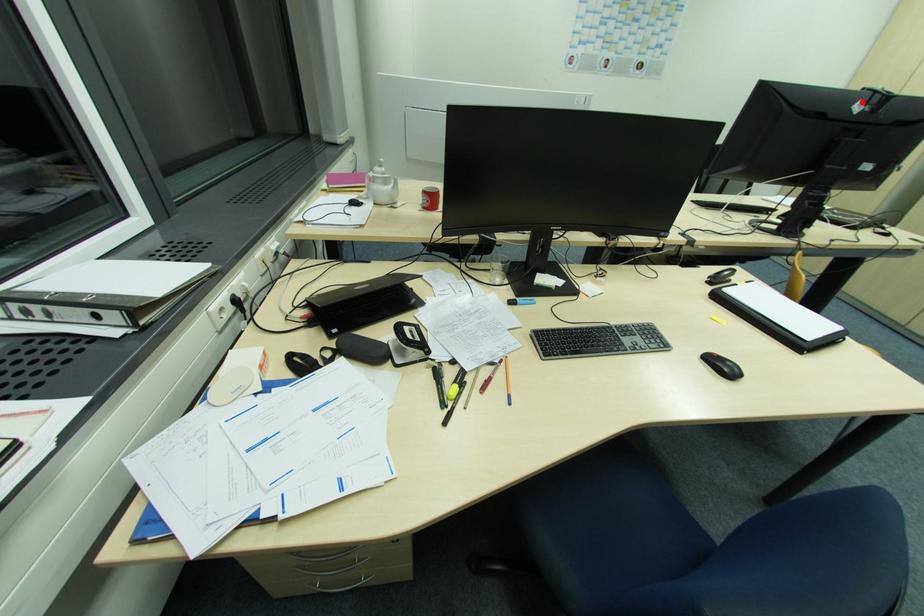
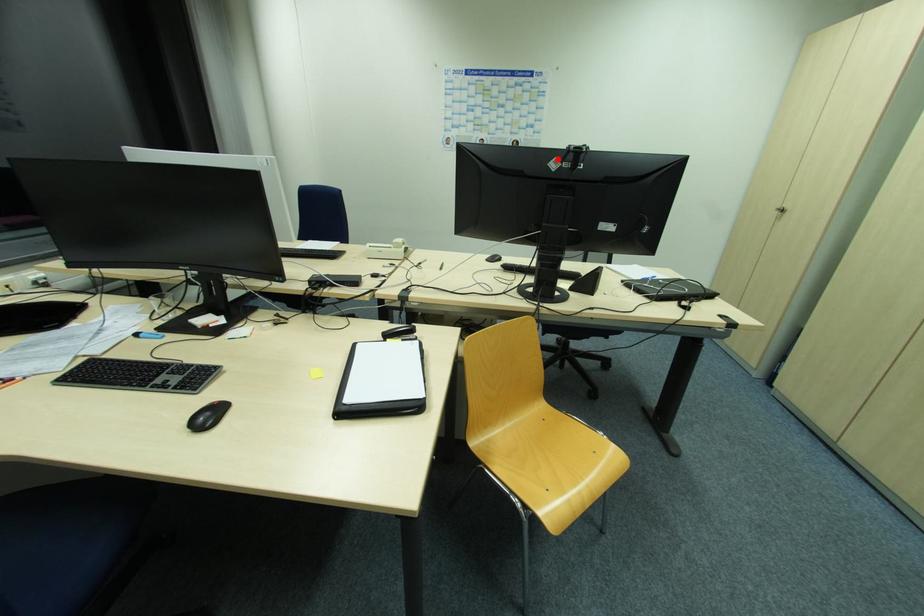
I am providing you with two images of the same scene from different viewpoints. A red point is marked on the first image and another point is marked on the second image. Are the points marked in image1 and image2 representing the same 3D position?

Yes